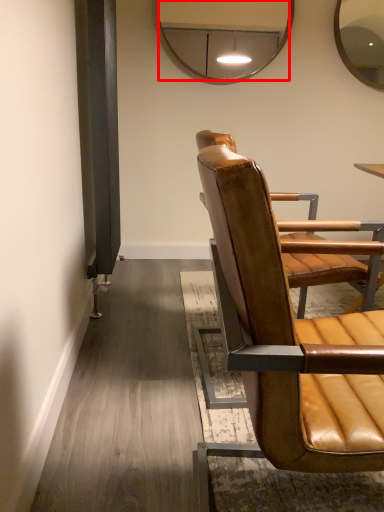
Question: From the image's perspective, where is mirror (annotated by the red box) located in relation to chair in the image?

Choices:
 (A) below
 (B) above

Answer: (B)